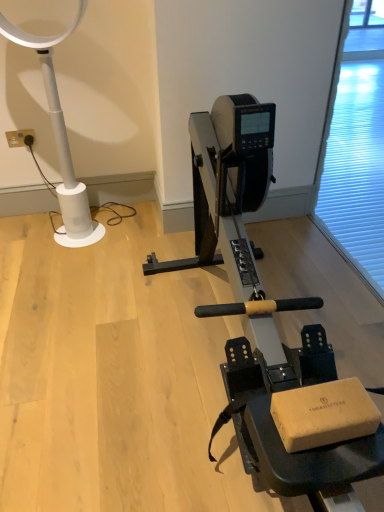
Find the location of a particular element. This screenshot has height=512, width=384. vacant space that is in between white plastic lamp at left and metallic silver stationary bicycle at center is located at coordinates (121, 314).